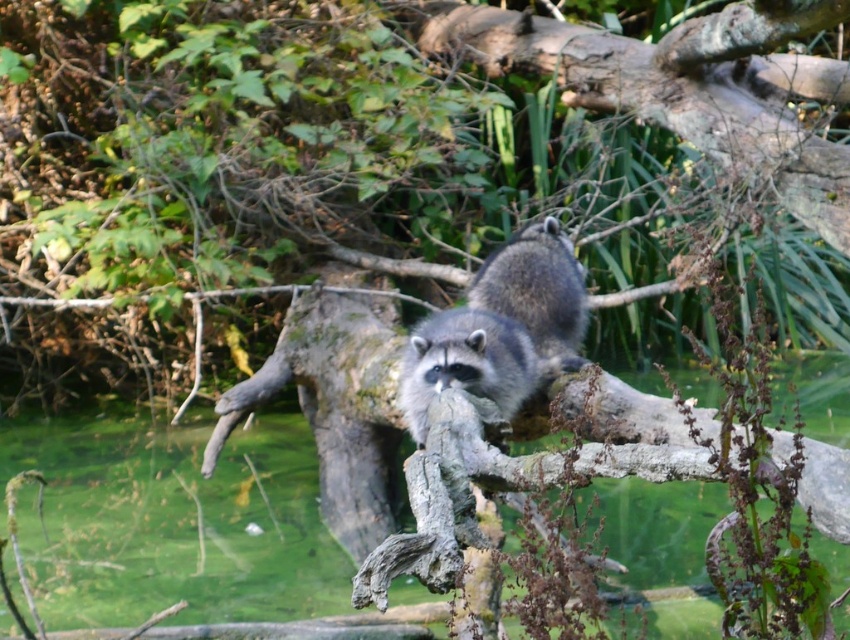
Does point (420, 369) come farther from viewer compared to point (553, 317)?

No.

Consider the image. Who is more forward, (x=425, y=388) or (x=573, y=291)?

Point (x=425, y=388)

Image resolution: width=850 pixels, height=640 pixels. What do you see at coordinates (465, 364) in the screenshot?
I see `fuzzy gray raccoon at center` at bounding box center [465, 364].

Identify the location of fuzzy gray raccoon at center. The image size is (850, 640). (465, 364).